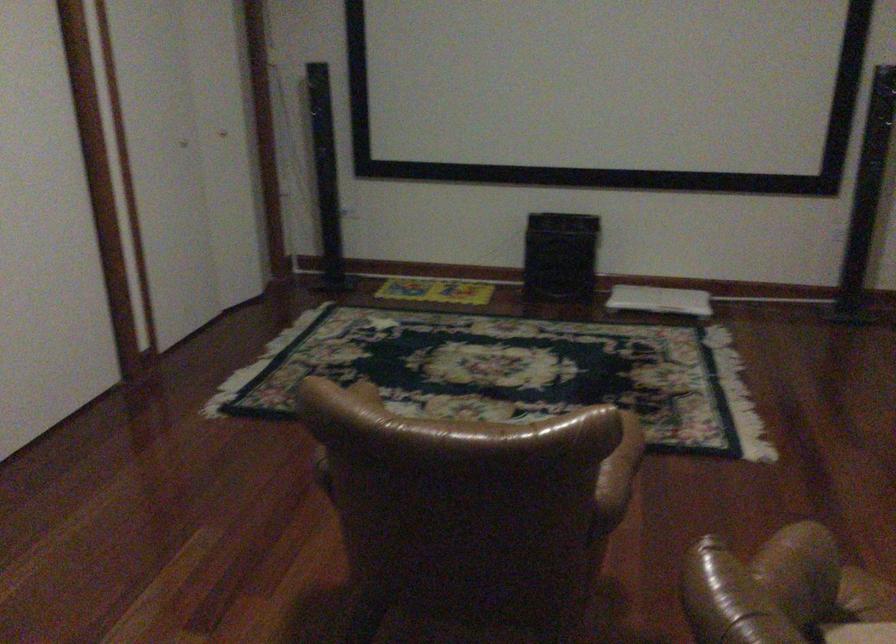
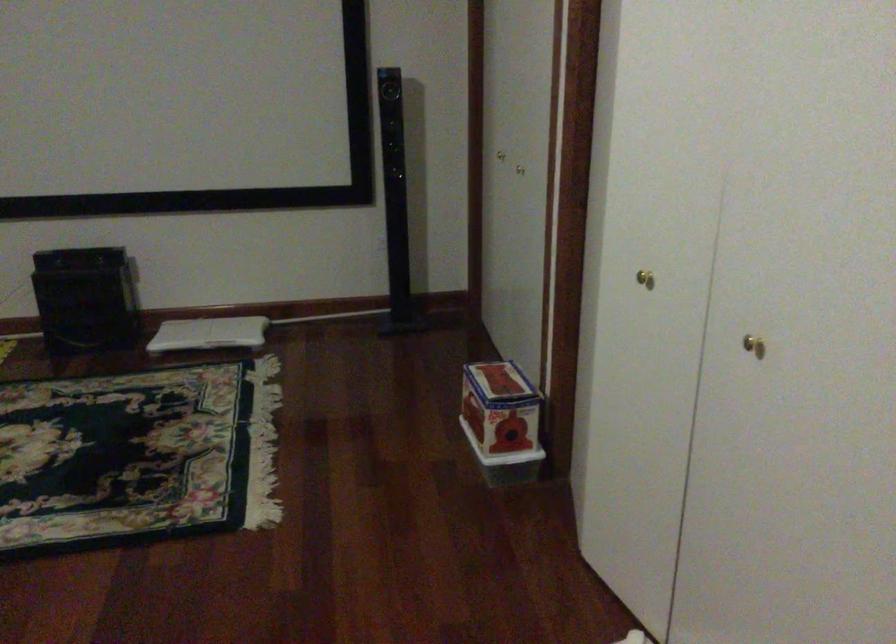
The images are taken continuously from a first-person perspective. In which direction are you moving?

The movement direction of the cameraman is right, forward.